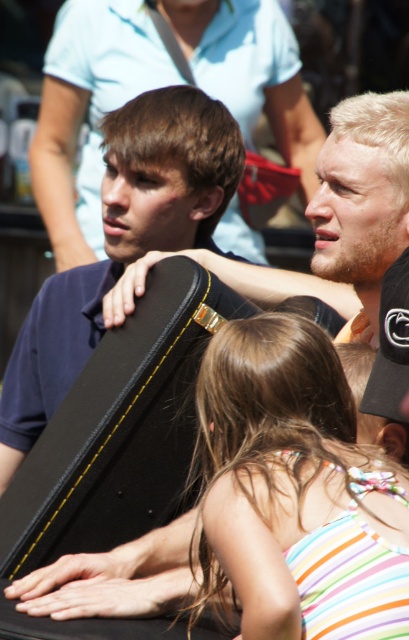
What is the exact location of the striped fabric dress at center in the image?

The striped fabric dress at center is located at point (x=294, y=490).

You are taking a photo of the scene and want to focus on both point [345,476] and point [209,227]. Which point should you focus on to ensure both are in sharp focus?

You should focus on point [345,476] because it is closer to the camera, and focusing on the closer point will keep both points in sharp focus.